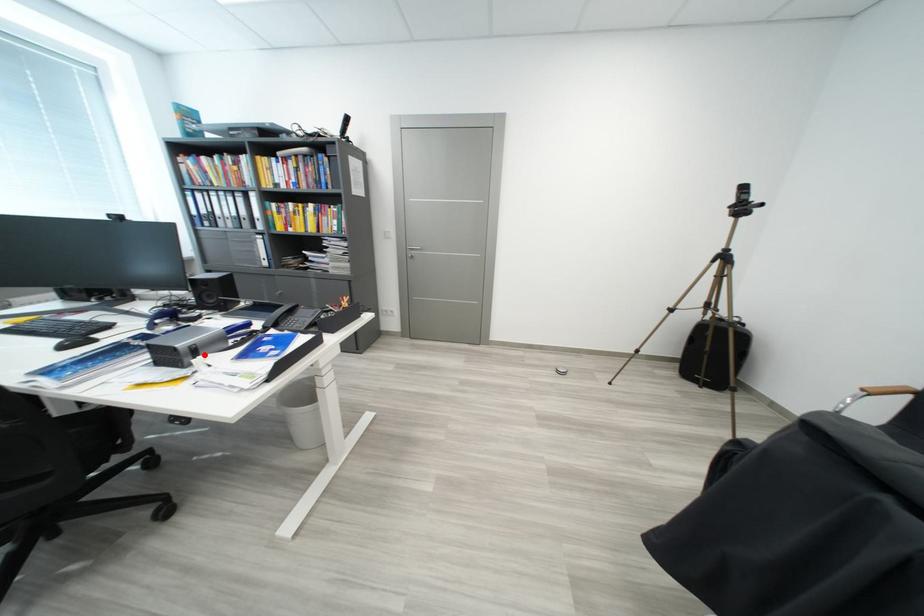
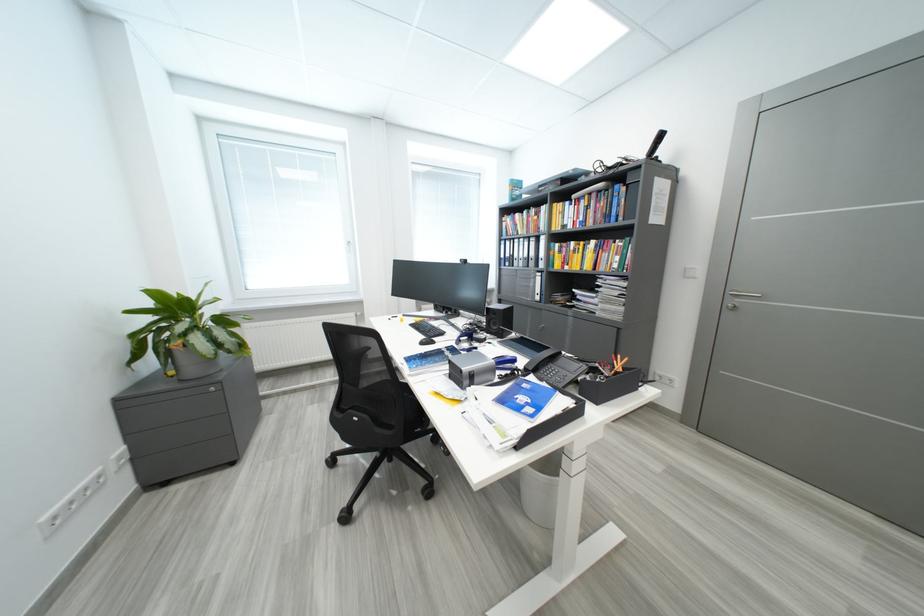
The point at the highlighted location is marked in the first image. Where is the corresponding point in the second image?

(481, 381)